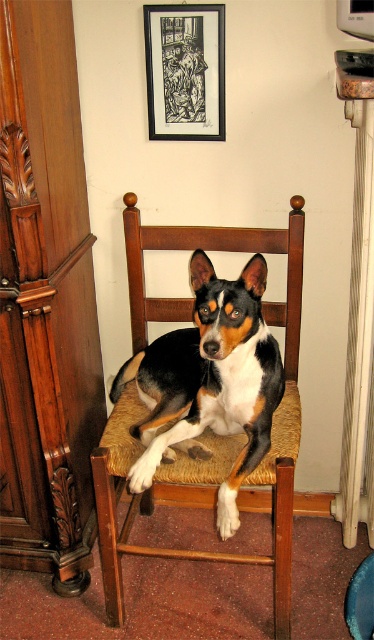
Question: Which point appears closest to the camera in this image?

Choices:
 (A) (54, 209)
 (B) (237, 314)
 (C) (192, 22)

Answer: (B)

Question: Estimate the real-world distances between objects in this image. Which object is farther from the brushed wood cabinet at left?

Choices:
 (A) black and white fur dog at center
 (B) black paper picture frame at upper center

Answer: (B)

Question: Does brushed wood cabinet at left lie behind black and white fur dog at center?

Choices:
 (A) yes
 (B) no

Answer: (B)

Question: Is brushed wood cabinet at left wider than black and white fur dog at center?

Choices:
 (A) no
 (B) yes

Answer: (A)

Question: Based on their relative distances, which object is nearer to the black paper picture frame at upper center?

Choices:
 (A) black and white fur dog at center
 (B) brushed wood cabinet at left

Answer: (B)

Question: Is black and white fur dog at center bigger than black paper picture frame at upper center?

Choices:
 (A) yes
 (B) no

Answer: (A)